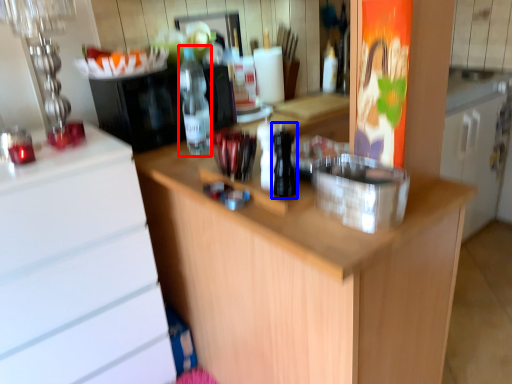
Question: Which object appears closest to the camera in this image, bottle (highlighted by a red box) or bottle (highlighted by a blue box)?

Choices:
 (A) bottle
 (B) bottle

Answer: (B)